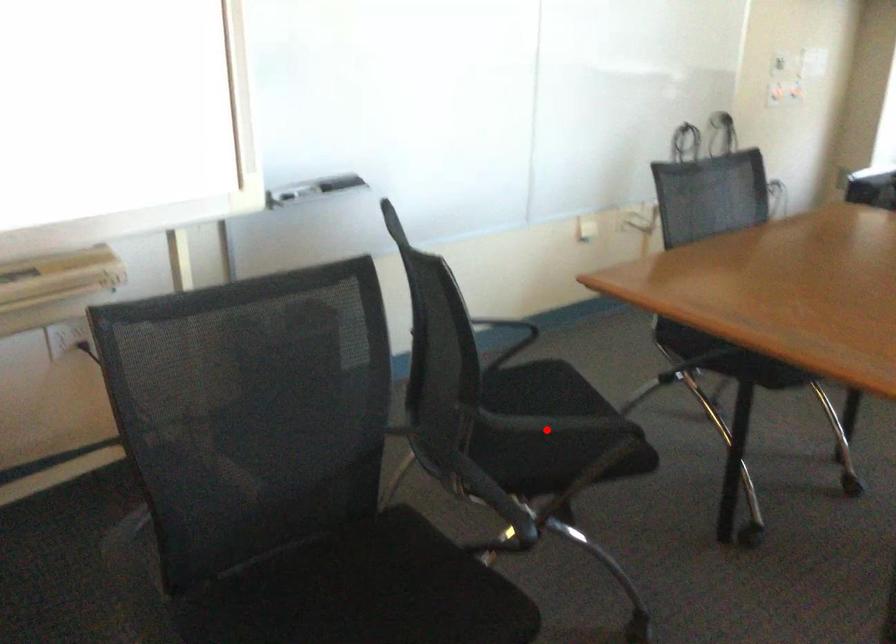
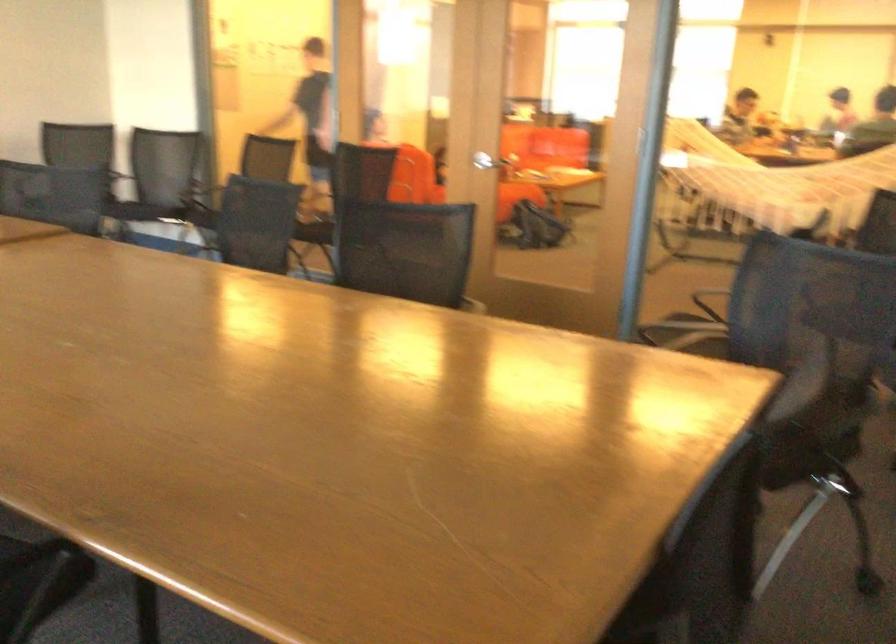
Question: I am providing you with two images of the same scene from different viewpoints. A red point is marked on the first image. Is the red point's position out of view in image 2?

Choices:
 (A) Yes
 (B) No

Answer: (A)